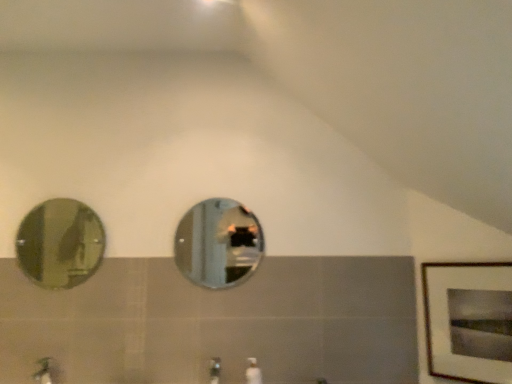
Question: Is white glossy soap dispenser at center located outside green matte faucet at lower left, positioned as the 2th faucet in right-to-left order?

Choices:
 (A) yes
 (B) no

Answer: (A)

Question: Is white glossy soap dispenser at center turned away from green matte faucet at lower left, which appears as the 1th faucet when viewed from the left?

Choices:
 (A) yes
 (B) no

Answer: (B)

Question: From the image's perspective, is white glossy soap dispenser at center over green matte faucet at lower left, which appears as the 1th faucet when viewed from the left?

Choices:
 (A) no
 (B) yes

Answer: (B)

Question: Is white glossy soap dispenser at center next to green matte faucet at lower left, which appears as the 1th faucet when viewed from the left?

Choices:
 (A) yes
 (B) no

Answer: (B)

Question: From the image's perspective, would you say white glossy soap dispenser at center is shown under green matte faucet at lower left, which appears as the 1th faucet when viewed from the left?

Choices:
 (A) yes
 (B) no

Answer: (B)

Question: Is white glossy soap dispenser at center smaller than green matte faucet at lower left, positioned as the 2th faucet in right-to-left order?

Choices:
 (A) no
 (B) yes

Answer: (B)

Question: Are green matte faucet at lower left, positioned as the 2th faucet in right-to-left order, and wooden framed print at right located far from each other?

Choices:
 (A) yes
 (B) no

Answer: (A)

Question: Does green matte faucet at lower left, positioned as the 2th faucet in right-to-left order, come behind wooden framed print at right?

Choices:
 (A) yes
 (B) no

Answer: (A)

Question: Is green matte faucet at lower left, positioned as the 2th faucet in right-to-left order, looking in the opposite direction of wooden framed print at right?

Choices:
 (A) yes
 (B) no

Answer: (B)

Question: Is wooden framed print at right located within green matte faucet at lower left, positioned as the 2th faucet in right-to-left order?

Choices:
 (A) no
 (B) yes

Answer: (A)

Question: Can you confirm if green matte faucet at lower left, positioned as the 2th faucet in right-to-left order, is wider than wooden framed print at right?

Choices:
 (A) yes
 (B) no

Answer: (A)

Question: Does green matte faucet at lower left, positioned as the 2th faucet in right-to-left order, come in front of wooden framed print at right?

Choices:
 (A) yes
 (B) no

Answer: (B)

Question: Is silver reflective mirror at center, the second mirror from the left, at the back of white glossy soap dispenser at center?

Choices:
 (A) no
 (B) yes

Answer: (A)